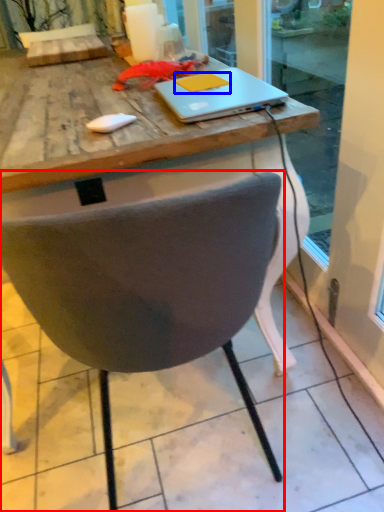
Question: Which object is further to the camera taking this photo, chair (highlighted by a red box) or notepad (highlighted by a blue box)?

Choices:
 (A) chair
 (B) notepad

Answer: (B)